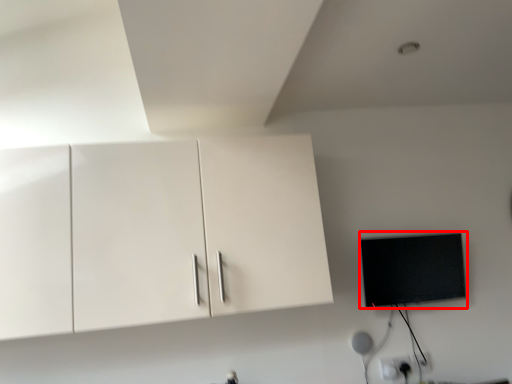
Question: From the image's perspective, what is the correct spatial relationship of flat (annotated by the red box) in relation to cabinetry?

Choices:
 (A) below
 (B) above

Answer: (A)